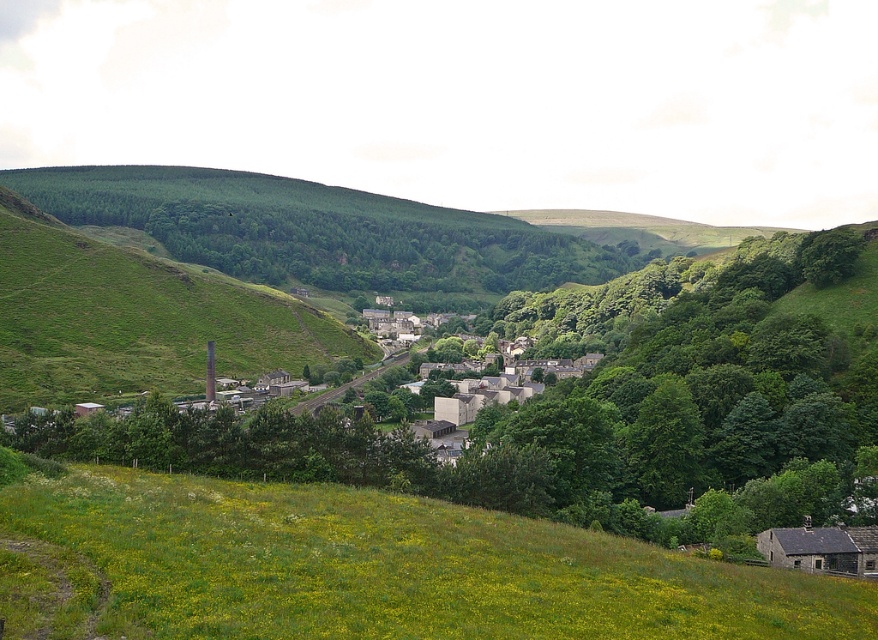
You are a hiker standing at the top of the valley and want to take a photo that includes both the green grassy hillside at lower center and the green grassy hillside at left. Which hillside should you move closer to in order to capture both in the same frame?

You should move closer to the green grassy hillside at lower center because it has a smaller width than the green grassy hillside at left, allowing both to fit within the frame more easily when positioned closer to the narrower one.

Looking at this image, you are standing at the point marked by the coordinates point at [396,566]. Looking around, what type of terrain are you currently on?

The point at [396,566] marks the green grassy hillside at lower center, so you are standing on a grassy hillside.